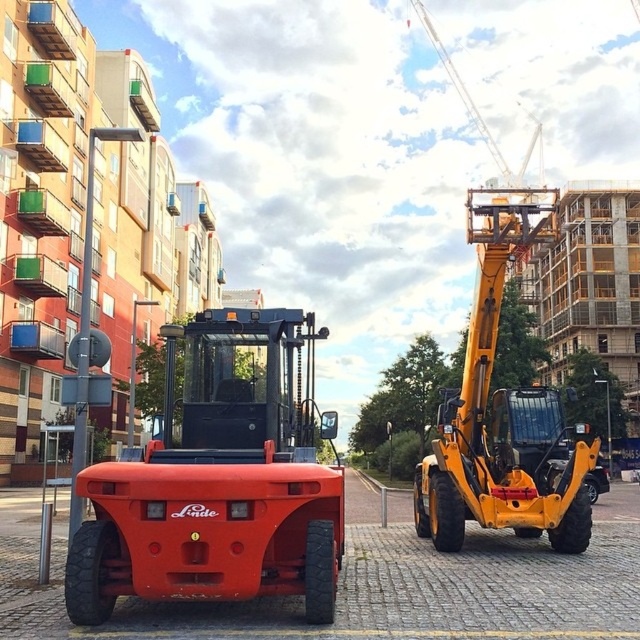
Question: Can you confirm if matte orange tractor at center is bigger than yellow metallic excavator at right?

Choices:
 (A) yes
 (B) no

Answer: (B)

Question: Which object is closer to the camera taking this photo?

Choices:
 (A) yellow metallic excavator at right
 (B) matte orange tractor at center

Answer: (B)

Question: Is matte orange tractor at center bigger than yellow metallic excavator at right?

Choices:
 (A) yes
 (B) no

Answer: (B)

Question: Is matte orange tractor at center smaller than yellow metallic excavator at right?

Choices:
 (A) no
 (B) yes

Answer: (B)